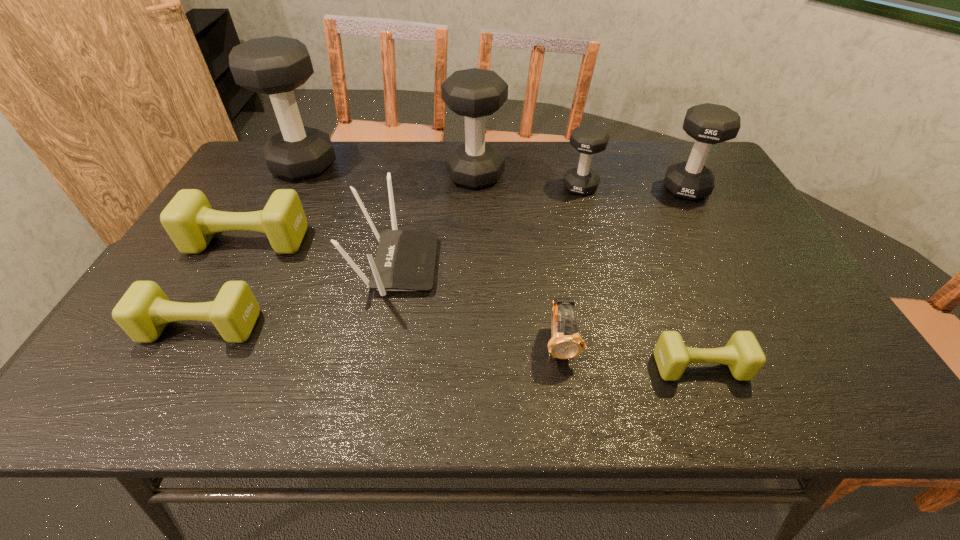
Find the location of `vacant space at the far edge`. vacant space at the far edge is located at coordinates (562, 157).

The height and width of the screenshot is (540, 960). Find the location of `free region at the near edge of the desktop`. free region at the near edge of the desktop is located at coordinates (254, 389).

Locate an element on the screen. free space at the left edge is located at coordinates (159, 365).

Locate an element on the screen. The height and width of the screenshot is (540, 960). vacant region at the right edge of the desktop is located at coordinates (735, 207).

The width and height of the screenshot is (960, 540). In order to click on vacant space at the far right corner of the desktop in this screenshot , I will do `click(655, 144)`.

This screenshot has width=960, height=540. Find the location of `empty space that is in between the watch and the nearest dumbbell`. empty space that is in between the watch and the nearest dumbbell is located at coordinates (631, 355).

Image resolution: width=960 pixels, height=540 pixels. What are the coordinates of `unoccupied position between the shortest object and the third biggest gray dumbbell` in the screenshot? It's located at (693, 278).

You are a GUI agent. You are given a task and a screenshot of the screen. Output one action in this format:
    pyautogui.click(x=<x>, y=<y>)
    Task: Click on the free space between the watch and the third tallest dumbbell
    This screenshot has height=540, width=960.
    Given the screenshot: What is the action you would take?
    pyautogui.click(x=623, y=266)

This screenshot has width=960, height=540. In order to click on vacant area that lies between the rightmost gray dumbbell and the smallest gray dumbbell in this screenshot , I will do `click(634, 188)`.

Find the location of `vacant area that lies between the router and the nearest dumbbell`. vacant area that lies between the router and the nearest dumbbell is located at coordinates (548, 316).